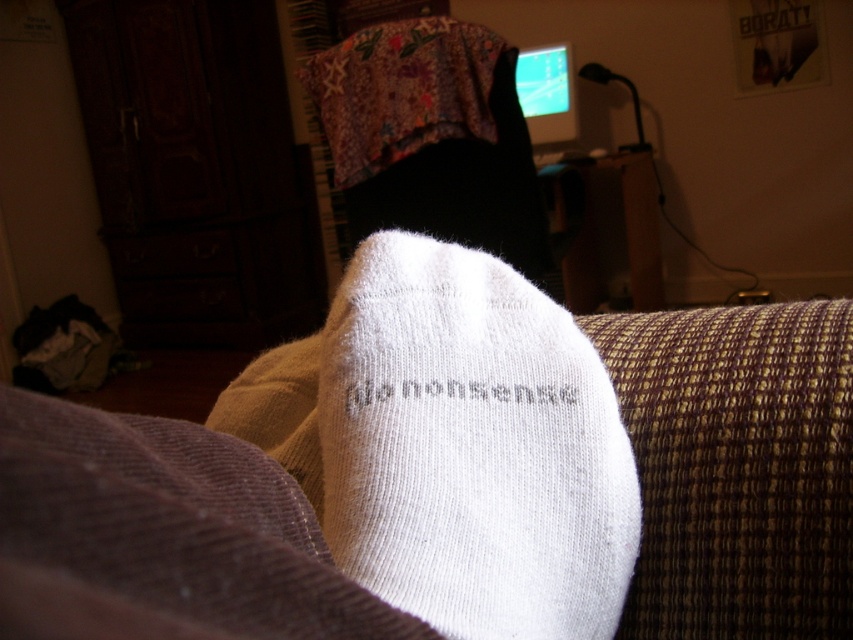
You are standing in the living room and want to take a photo of both point (311,563) and point (386,438). Since the camera can only focus on one point at a time, which point should you focus on first to ensure the closer one is sharp?

You should focus on point (311,563) first because it is closer to the camera than point (386,438), ensuring the closer point is in focus before adjusting for the farther one.

You are a delivery robot standing at the entrance of the room. You need to place a small package on the floor at the point marked as point (846, 508). The robot has a height of 24 inches. Will the robot be able to see the point after placing the package?

The distance of point (846, 508) from camera is 18.29 inches. Since the robot is 24 inches tall, which is taller than the distance to the point, the robot will be able to see the point after placing the package.

You are standing in the living room and want to sit down on the white knitted couch at lower center. Based on its coordinates, where exactly should you move to reach it?

The white knitted couch at lower center is located at coordinates point (738, 467), so you should move to that point to reach it.